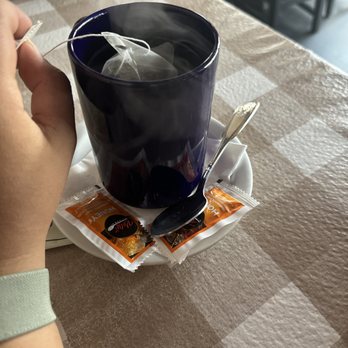
I want to click on table, so click(299, 184).